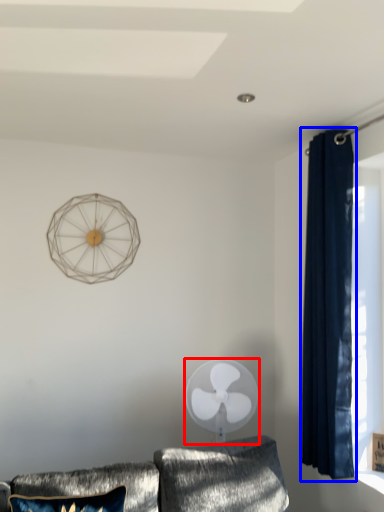
Question: Which object is closer to the camera taking this photo, mechanical fan (highlighted by a red box) or curtain (highlighted by a blue box)?

Choices:
 (A) mechanical fan
 (B) curtain

Answer: (B)